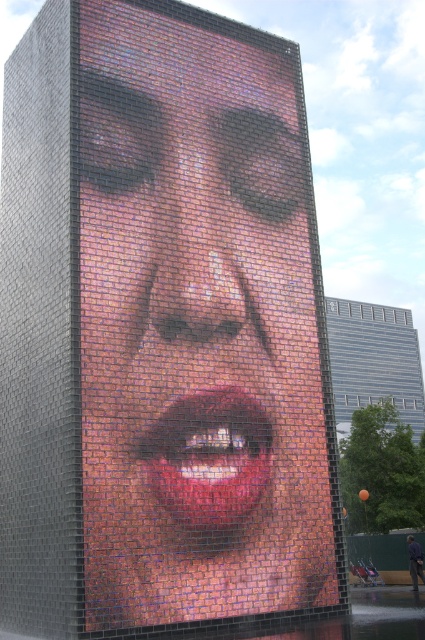
Question: Which object appears farthest from the camera in this image?

Choices:
 (A) shiny metallic face at center
 (B) shiny pink lips at center

Answer: (B)

Question: Is shiny metallic face at center closer to camera compared to shiny pink lips at center?

Choices:
 (A) yes
 (B) no

Answer: (A)

Question: Considering the relative positions of shiny metallic face at center and shiny pink lips at center in the image provided, where is shiny metallic face at center located with respect to shiny pink lips at center?

Choices:
 (A) above
 (B) below

Answer: (A)

Question: Which point is farther to the camera?

Choices:
 (A) (235, 444)
 (B) (260, 428)

Answer: (B)

Question: Does shiny metallic face at center lie in front of shiny pink lips at center?

Choices:
 (A) yes
 (B) no

Answer: (A)

Question: Which point is farther to the camera?

Choices:
 (A) shiny metallic face at center
 (B) shiny pink lips at center

Answer: (B)